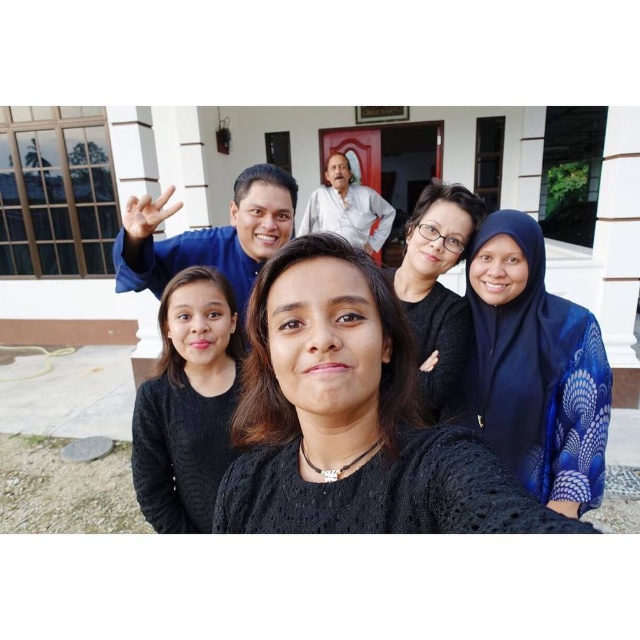
This screenshot has width=640, height=640. What do you see at coordinates (188, 403) in the screenshot?
I see `black knitted sweater at center` at bounding box center [188, 403].

Which is behind, point (216, 442) or point (465, 237)?

The point (465, 237) is more distant.

Which is in front, point (195, 504) or point (432, 266)?

Point (195, 504) is in front.

This screenshot has height=640, width=640. I want to click on black knitted sweater at center, so click(188, 403).

Is point (168, 499) positioned in front of point (346, 236)?

Yes, point (168, 499) is in front of point (346, 236).

Image resolution: width=640 pixels, height=640 pixels. What do you see at coordinates (188, 403) in the screenshot? I see `black knitted sweater at center` at bounding box center [188, 403].

This screenshot has width=640, height=640. Identify the location of black knitted sweater at center. (188, 403).

Does blue silk hijab at right appear on the right side of white cotton shirt at upper center?

Yes, blue silk hijab at right is to the right of white cotton shirt at upper center.

Who is more forward, (540, 440) or (380, 202)?

Positioned in front is point (540, 440).

You are a GUI agent. You are given a task and a screenshot of the screen. Output one action in this format:
    pyautogui.click(x=<x>, y=<y>)
    Task: Click on the blue silk hijab at right
    
    Given the screenshot: What is the action you would take?
    pyautogui.click(x=534, y=369)

The width and height of the screenshot is (640, 640). In order to click on blue silk hijab at right in this screenshot , I will do `click(534, 369)`.